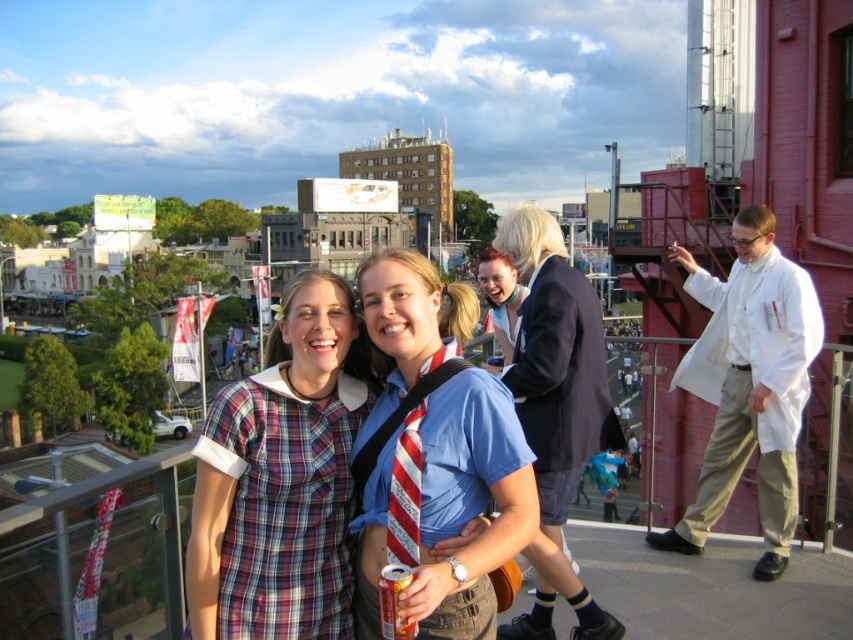
Is plaid fabric dress at center thinner than white lab coat at right?

No, plaid fabric dress at center is not thinner than white lab coat at right.

Between point (322, 332) and point (758, 410), which one is positioned in front?

Positioned in front is point (758, 410).

Is point (231, 602) closer to viewer compared to point (749, 349)?

Yes, point (231, 602) is in front of point (749, 349).

What are the coordinates of `plaid fabric dress at center` in the screenshot? It's located at pyautogui.click(x=282, y=476).

Can you confirm if white lab coat at right is positioned to the right of blonde hair at center?

Correct, you'll find white lab coat at right to the right of blonde hair at center.

Can you confirm if white lab coat at right is thinner than blonde hair at center?

No, white lab coat at right is not thinner than blonde hair at center.

Is point (764, 406) in front of point (491, 268)?

That is True.

Image resolution: width=853 pixels, height=640 pixels. I want to click on white lab coat at right, so click(x=747, y=385).

Can you confirm if plaid fabric dress at center is shorter than blonde hair at center?

In fact, plaid fabric dress at center may be taller than blonde hair at center.

How distant is plaid fabric dress at center from blonde hair at center?

plaid fabric dress at center and blonde hair at center are 42.16 feet apart.

Identify the location of plaid fabric dress at center. The image size is (853, 640). (282, 476).

You are a GUI agent. You are given a task and a screenshot of the screen. Output one action in this format:
    pyautogui.click(x=<x>, y=<y>)
    Task: Click on the plaid fabric dress at center
    Image resolution: width=853 pixels, height=640 pixels.
    Given the screenshot: What is the action you would take?
    click(x=282, y=476)